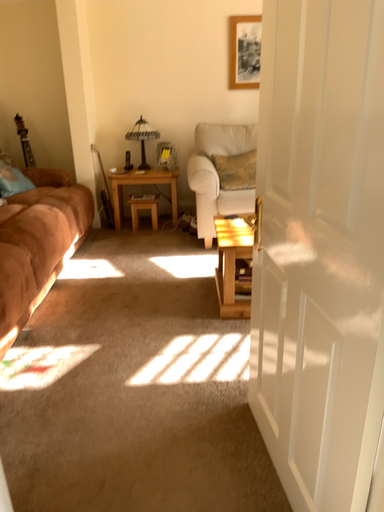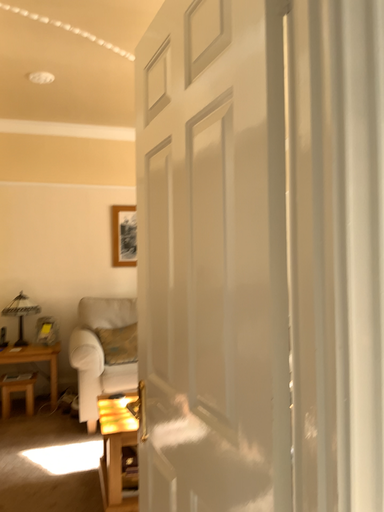
Question: How did the camera likely rotate when shooting the video?

Choices:
 (A) rotated right
 (B) rotated left

Answer: (A)